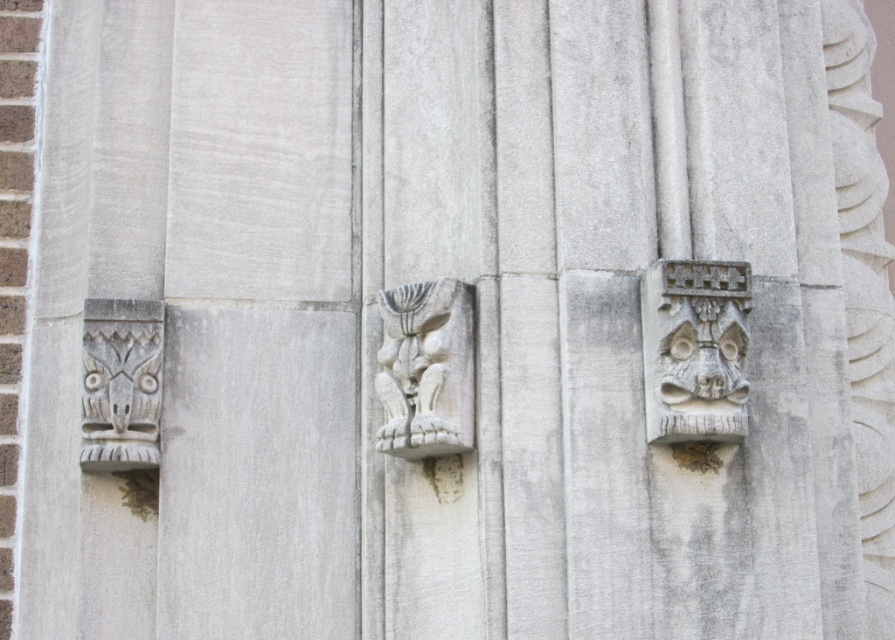
Can you confirm if white stone mask at right is bigger than white stone carving at center?

Yes, white stone mask at right is bigger than white stone carving at center.

Does white stone mask at right come in front of white stone carving at center?

Yes, white stone mask at right is in front of white stone carving at center.

Describe the element at coordinates (695, 349) in the screenshot. I see `white stone mask at right` at that location.

Where is `white stone mask at right`? Image resolution: width=895 pixels, height=640 pixels. white stone mask at right is located at coordinates tap(695, 349).

Which is more to the right, white stone mask at right or white stone carving at left?

Positioned to the right is white stone mask at right.

The width and height of the screenshot is (895, 640). Find the location of `white stone mask at right`. white stone mask at right is located at coordinates (695, 349).

At what (x,y) coordinates should I click in order to perform the action: click on white stone mask at right. Please return your answer as a coordinate pair (x, y). Looking at the image, I should click on (695, 349).

From the picture: Who is lower down, white stone carving at center or white stone carving at left?

white stone carving at left is below.

Is point (437, 360) farther from camera compared to point (160, 342)?

That is False.

Where is `white stone carving at center`? This screenshot has height=640, width=895. white stone carving at center is located at coordinates (425, 369).